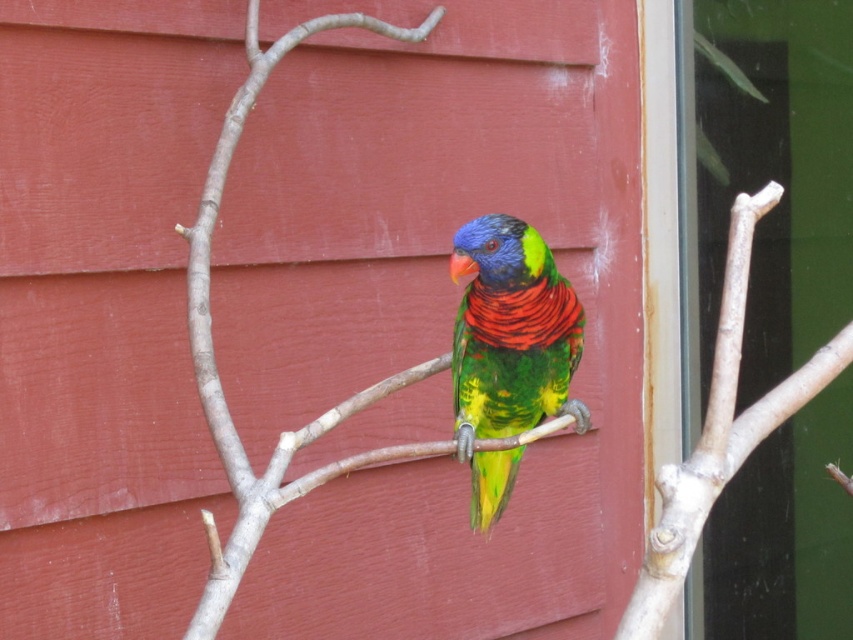
You are holding a small toy that needs to be placed between the transparent glass at center and the smooth wood branch at center. Which object should you place it closer to if you want it to be near the left side of the branch?

You should place the toy closer to the smooth wood branch at center because the transparent glass at center is on the right side of the branch, so placing it near the branch would position it towards the left side.